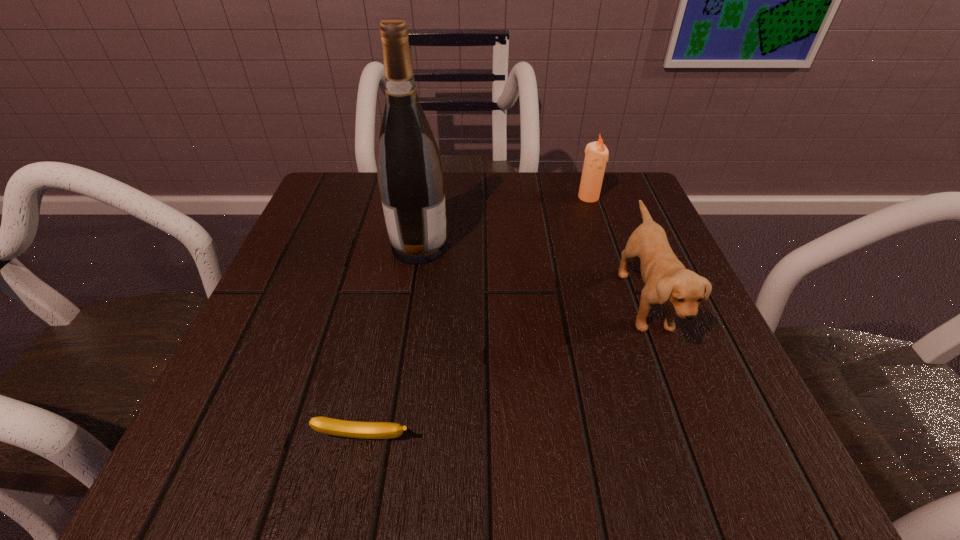
Identify the location of vacant position at the left edge of the desktop. The height and width of the screenshot is (540, 960). (333, 346).

In order to click on vacant space at the far right corner of the desktop in this screenshot , I will do `click(622, 205)`.

At what (x,y) coordinates should I click in order to perform the action: click on vacant area at the near right corner of the desktop. Please return your answer as a coordinate pair (x, y). Image resolution: width=960 pixels, height=540 pixels. Looking at the image, I should click on (636, 415).

Where is `empty location between the tallest object and the candle`? This screenshot has width=960, height=540. empty location between the tallest object and the candle is located at coordinates (504, 222).

You are a GUI agent. You are given a task and a screenshot of the screen. Output one action in this format:
    pyautogui.click(x=<x>, y=<y>)
    Task: Click on the blank region between the puppy and the wine bottle
    
    Given the screenshot: What is the action you would take?
    pyautogui.click(x=532, y=274)

Locate an element on the screen. This screenshot has width=960, height=540. vacant space in between the banana and the puppy is located at coordinates (504, 369).

You are a GUI agent. You are given a task and a screenshot of the screen. Output one action in this format:
    pyautogui.click(x=<x>, y=<y>)
    Task: Click on the unoccupied position between the candle and the nearest object
    The image size is (960, 540).
    Given the screenshot: What is the action you would take?
    pyautogui.click(x=476, y=318)

The width and height of the screenshot is (960, 540). Find the location of `free space between the puppy and the farthest object`. free space between the puppy and the farthest object is located at coordinates pyautogui.click(x=616, y=249).

Where is `free space between the tallest object and the banana`? This screenshot has width=960, height=540. free space between the tallest object and the banana is located at coordinates (392, 342).

I want to click on vacant region between the banana and the wine bottle, so click(x=392, y=342).